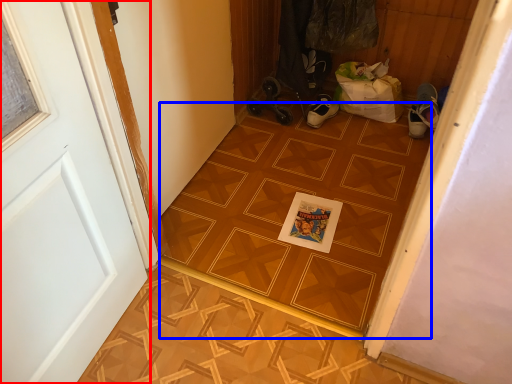
Question: Among these objects, which one is farthest to the camera, door (highlighted by a red box) or ceramic tile (highlighted by a blue box)?

Choices:
 (A) door
 (B) ceramic tile

Answer: (B)